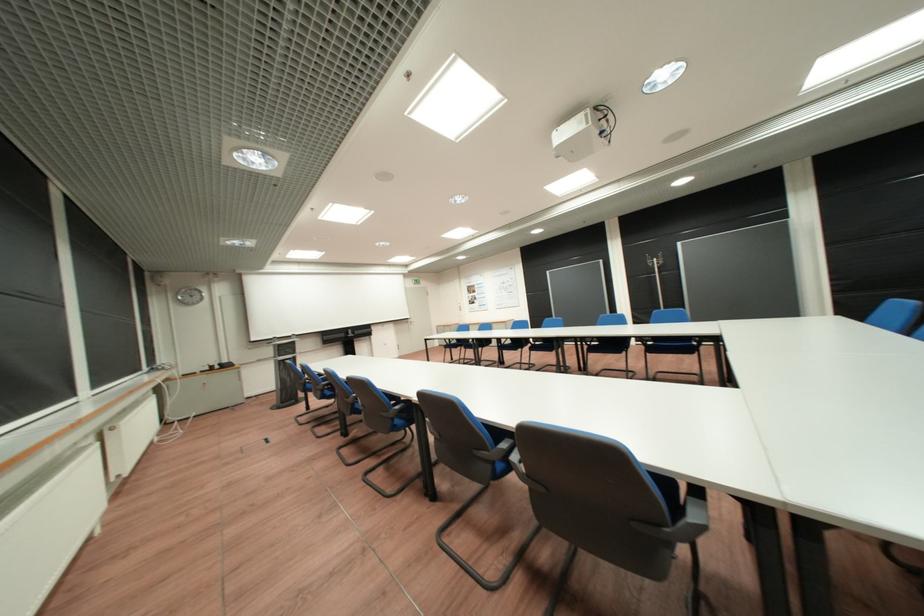
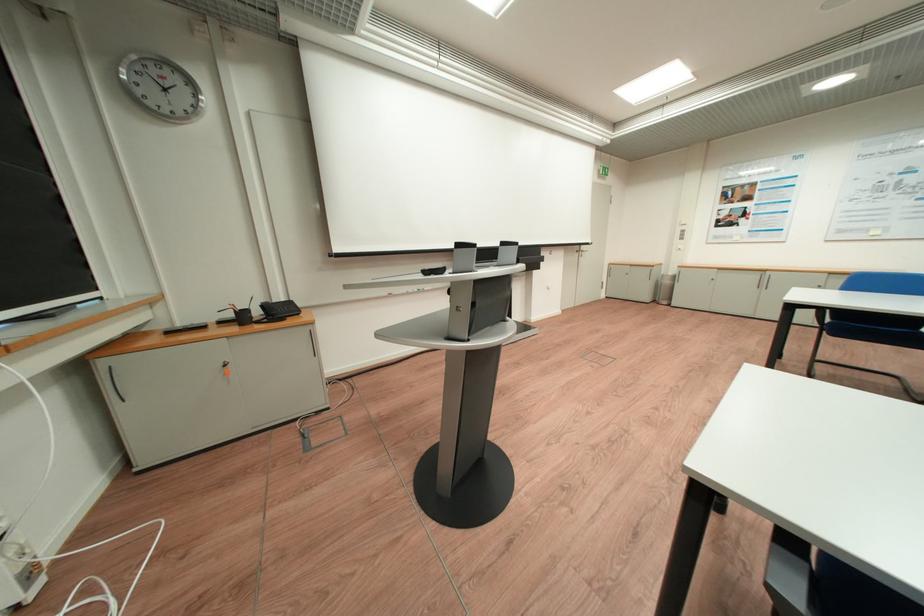
The point at (229, 369) is marked in the first image. Where is the corresponding point in the second image?

(271, 314)